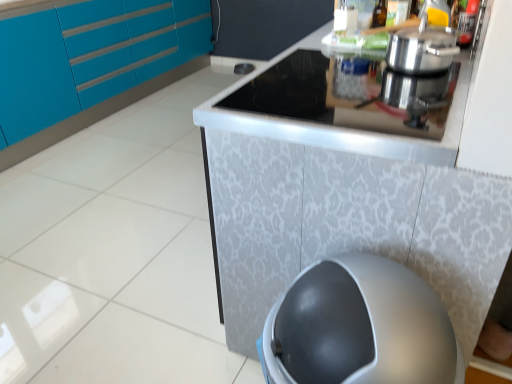
Question: Does translucent glass bottle at upper center have a smaller size compared to black glass cooktop at upper center?

Choices:
 (A) yes
 (B) no

Answer: (A)

Question: Are translucent glass bottle at upper center and black glass cooktop at upper center beside each other?

Choices:
 (A) yes
 (B) no

Answer: (B)

Question: Can you confirm if translucent glass bottle at upper center is shorter than black glass cooktop at upper center?

Choices:
 (A) yes
 (B) no

Answer: (B)

Question: Considering the relative sizes of translucent glass bottle at upper center and black glass cooktop at upper center in the image provided, is translucent glass bottle at upper center wider than black glass cooktop at upper center?

Choices:
 (A) no
 (B) yes

Answer: (A)

Question: Does translucent glass bottle at upper center have a larger size compared to black glass cooktop at upper center?

Choices:
 (A) yes
 (B) no

Answer: (B)

Question: Is point (33, 115) closer or farther from the camera than point (384, 23)?

Choices:
 (A) closer
 (B) farther

Answer: (B)

Question: From the image's perspective, is teal glossy cabinets at upper left positioned above or below translucent glass bottle at upper center?

Choices:
 (A) below
 (B) above

Answer: (B)

Question: Is teal glossy cabinets at upper left taller or shorter than translucent glass bottle at upper center?

Choices:
 (A) tall
 (B) short

Answer: (A)

Question: From a real-world perspective, is teal glossy cabinets at upper left positioned above or below translucent glass bottle at upper center?

Choices:
 (A) below
 (B) above

Answer: (A)

Question: From a real-world perspective, is translucent glass bottle at upper center above or below teal glossy cabinets at upper left?

Choices:
 (A) above
 (B) below

Answer: (A)

Question: Is translucent glass bottle at upper center taller or shorter than teal glossy cabinets at upper left?

Choices:
 (A) tall
 (B) short

Answer: (B)

Question: Based on their sizes in the image, would you say translucent glass bottle at upper center is bigger or smaller than teal glossy cabinets at upper left?

Choices:
 (A) big
 (B) small

Answer: (B)

Question: From the image's perspective, is translucent glass bottle at upper center positioned above or below teal glossy cabinets at upper left?

Choices:
 (A) below
 (B) above

Answer: (A)

Question: Looking at their shapes, would you say translucent glass bottle at upper center is wider or thinner than black glass cooktop at upper center?

Choices:
 (A) thin
 (B) wide

Answer: (A)

Question: From a real-world perspective, is translucent glass bottle at upper center physically located above or below black glass cooktop at upper center?

Choices:
 (A) below
 (B) above

Answer: (B)